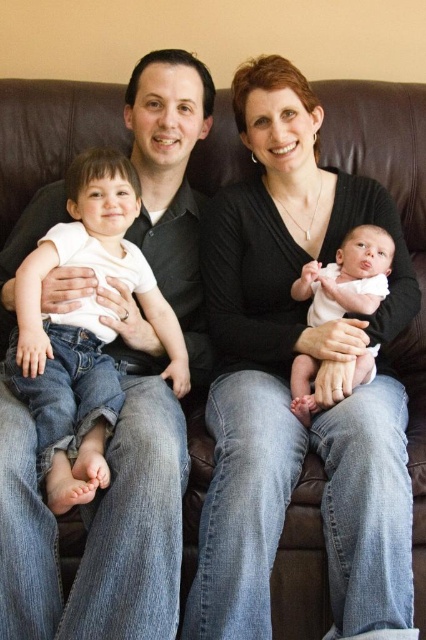
Is black matte sweater at center bigger than matte black shirt at left?

No, black matte sweater at center is not bigger than matte black shirt at left.

Between point (328, 476) and point (34, 589), which one is positioned in front?

Point (34, 589) is in front.

The width and height of the screenshot is (426, 640). Describe the element at coordinates (288, 378) in the screenshot. I see `black matte sweater at center` at that location.

This screenshot has height=640, width=426. In order to click on black matte sweater at center in this screenshot , I will do `click(288, 378)`.

Is black matte sweater at center shorter than soft pink fabric baby at center?

No.

In the scene shown: Is black matte sweater at center closer to the viewer compared to soft pink fabric baby at center?

Yes, black matte sweater at center is in front of soft pink fabric baby at center.

Image resolution: width=426 pixels, height=640 pixels. I want to click on black matte sweater at center, so click(x=288, y=378).

Does matte black shirt at left appear on the right side of soft pink fabric baby at center?

Incorrect, matte black shirt at left is not on the right side of soft pink fabric baby at center.

Can you confirm if matte black shirt at left is positioned to the left of soft pink fabric baby at center?

Yes, matte black shirt at left is to the left of soft pink fabric baby at center.

Where is `matte black shirt at left`? The image size is (426, 640). matte black shirt at left is located at coordinates 98,500.

What are the coordinates of `matte black shirt at left` in the screenshot? It's located at (98, 500).